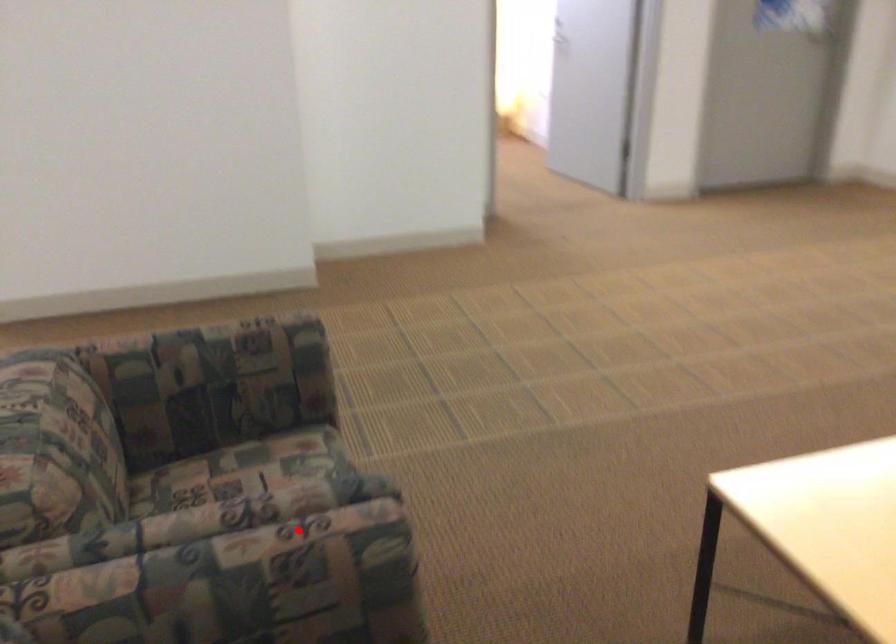
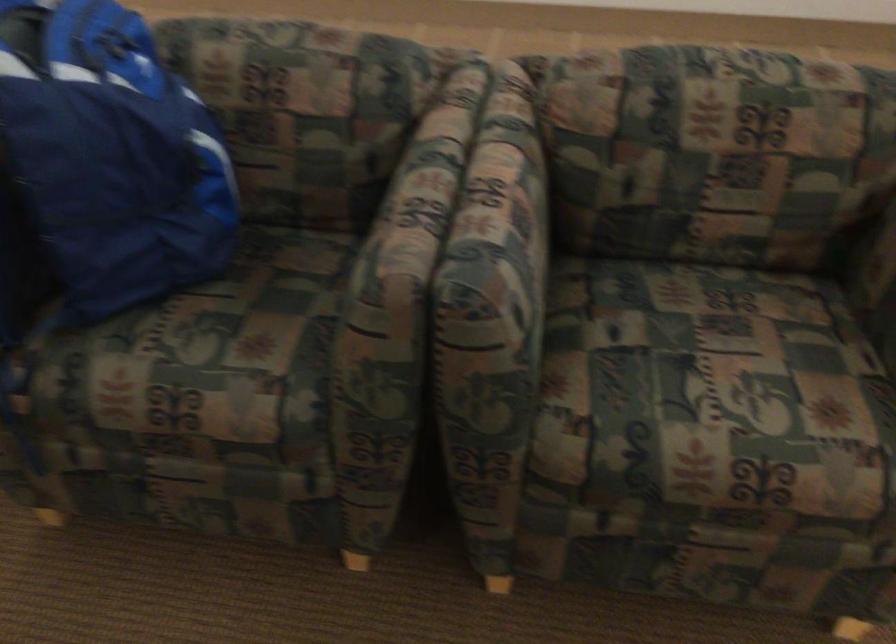
Question: I am providing you with two images of the same scene from different viewpoints. A red point is shown in image1. For the corresponding object point in image2, is it positioned nearer or farther from the camera?

Choices:
 (A) Nearer
 (B) Farther

Answer: (A)